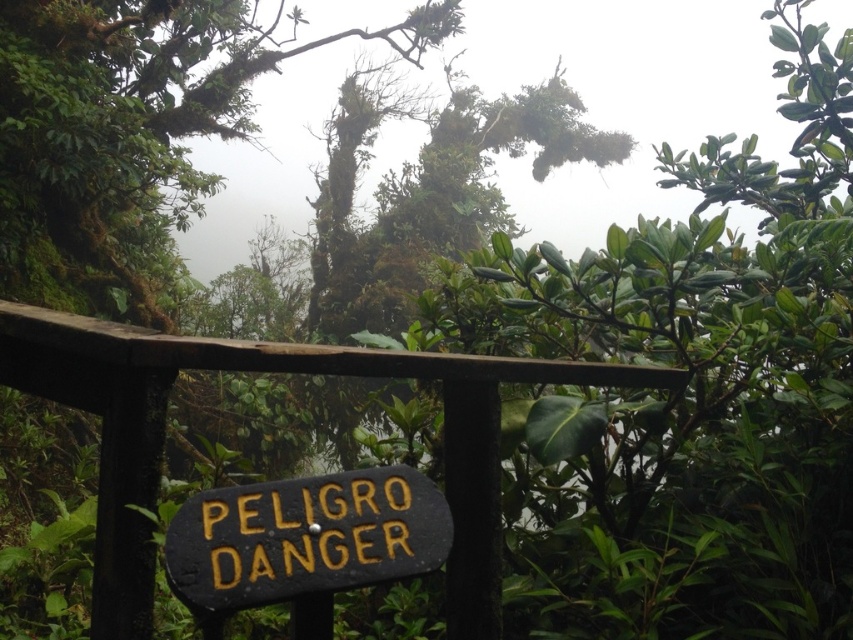
Question: Does brown wood rail at center appear under black painted wood sign at center?

Choices:
 (A) no
 (B) yes

Answer: (A)

Question: Which of the following is the farthest from the observer?

Choices:
 (A) brown wood rail at center
 (B) black painted wood sign at center

Answer: (A)

Question: Which object appears closest to the camera in this image?

Choices:
 (A) black painted wood sign at center
 (B) brown wood rail at center

Answer: (A)

Question: Does brown wood rail at center have a smaller size compared to black painted wood sign at center?

Choices:
 (A) no
 (B) yes

Answer: (A)

Question: Can you confirm if brown wood rail at center is positioned to the left of black painted wood sign at center?

Choices:
 (A) yes
 (B) no

Answer: (A)